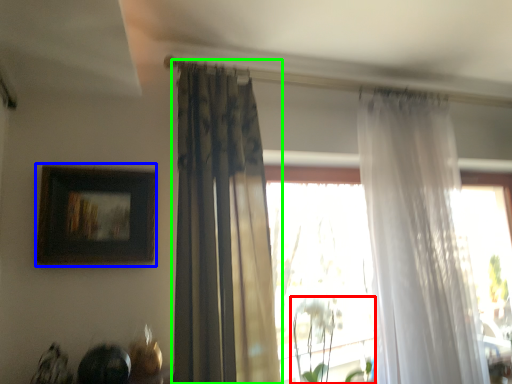
Question: Based on their relative distances, which object is nearer to plant (highlighted by a red box)? Choose from picture frame (highlighted by a blue box) and curtain (highlighted by a green box).

Choices:
 (A) picture frame
 (B) curtain

Answer: (B)